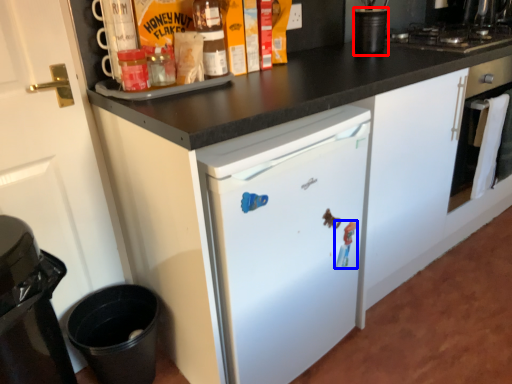
Question: Which object is closer to the camera taking this photo, appliance (highlighted by a red box) or toy (highlighted by a blue box)?

Choices:
 (A) appliance
 (B) toy

Answer: (B)